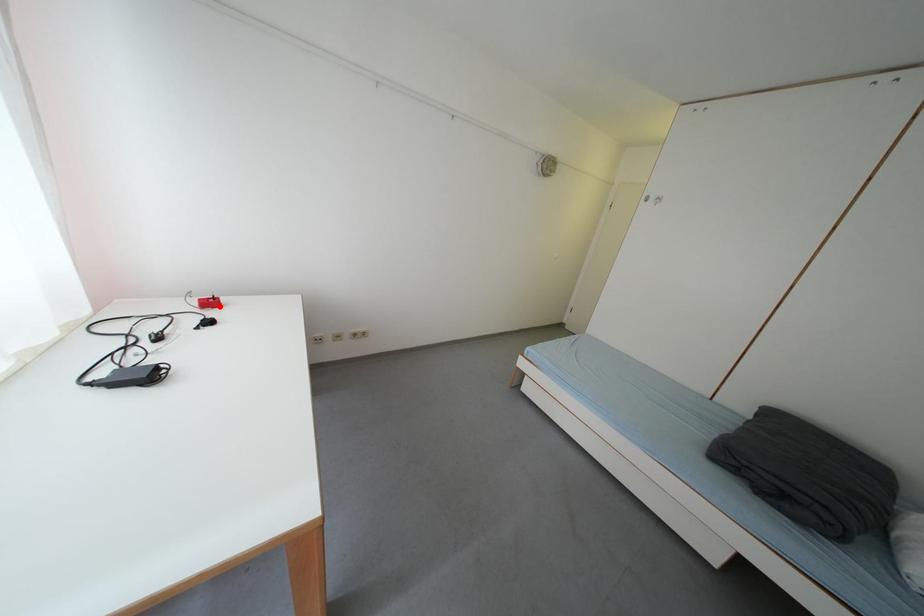
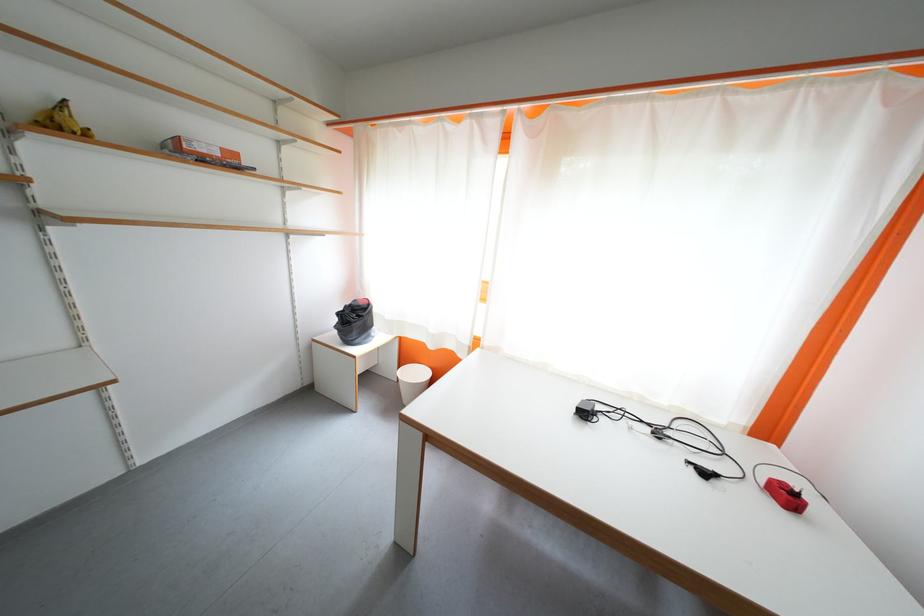
The point at the highlighted location is marked in the first image. Where is the corresponding point in the second image?

(796, 500)